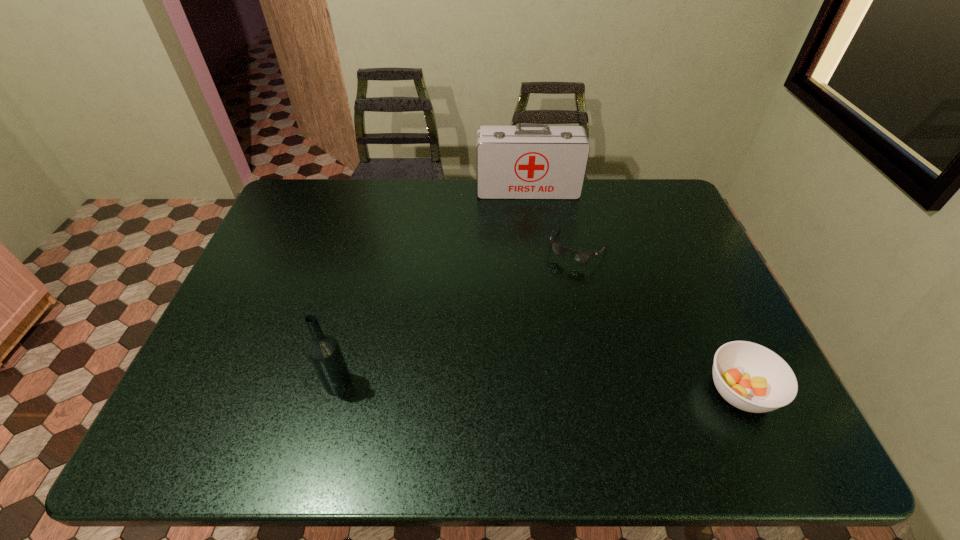
This screenshot has width=960, height=540. I want to click on vacant space at the near edge of the desktop, so click(x=279, y=374).

Locate an element on the screen. The height and width of the screenshot is (540, 960). vacant space at the left edge of the desktop is located at coordinates (253, 265).

Locate an element on the screen. vacant area at the far left corner of the desktop is located at coordinates (312, 193).

You are a GUI agent. You are given a task and a screenshot of the screen. Output one action in this format:
    pyautogui.click(x=<x>, y=<y>)
    Task: Click on the vacant space at the far right corner of the desktop
    The width and height of the screenshot is (960, 540).
    Given the screenshot: What is the action you would take?
    pos(653,215)

In order to click on unoccupied area between the leftmost object and the farthest object in this screenshot , I will do `click(433, 286)`.

I want to click on empty space between the soup bowl and the sunglasses, so click(659, 320).

The height and width of the screenshot is (540, 960). Find the location of `free space between the sunglasses and the soup bowl`. free space between the sunglasses and the soup bowl is located at coordinates (659, 320).

The image size is (960, 540). I want to click on unoccupied area between the first-aid kit and the rightmost object, so click(x=634, y=291).

The image size is (960, 540). I want to click on empty location between the shortest object and the soup bowl, so click(x=659, y=320).

Find the location of a particular element. The width and height of the screenshot is (960, 540). vacant space in between the vodka and the first-aid kit is located at coordinates (433, 286).